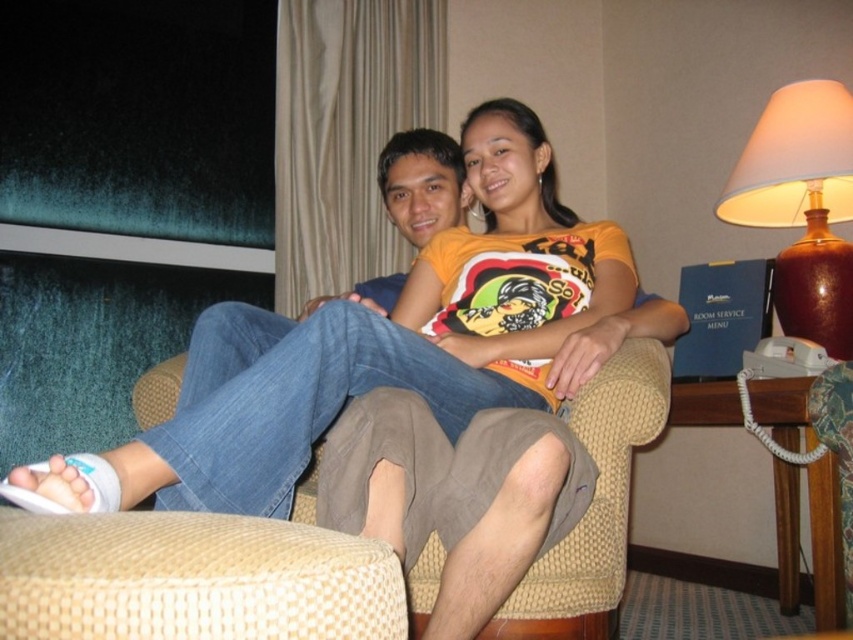
Question: Which point is farther from the camera taking this photo?

Choices:
 (A) (828, 353)
 (B) (515, 236)

Answer: (A)

Question: Among these points, which one is nearest to the camera?

Choices:
 (A) (799, 166)
 (B) (234, 410)

Answer: (B)

Question: Is white fabric sandals at lower left wider than brown ceramic lamp at upper right?

Choices:
 (A) yes
 (B) no

Answer: (A)

Question: Does white fabric sandals at lower left lie behind brown ceramic lamp at upper right?

Choices:
 (A) no
 (B) yes

Answer: (A)

Question: Which of the following is the farthest from the observer?

Choices:
 (A) brown ceramic lamp at upper right
 (B) white fabric sandals at lower left

Answer: (A)

Question: Considering the relative positions of white fabric sandals at lower left and brown ceramic lamp at upper right in the image provided, where is white fabric sandals at lower left located with respect to brown ceramic lamp at upper right?

Choices:
 (A) above
 (B) below

Answer: (B)